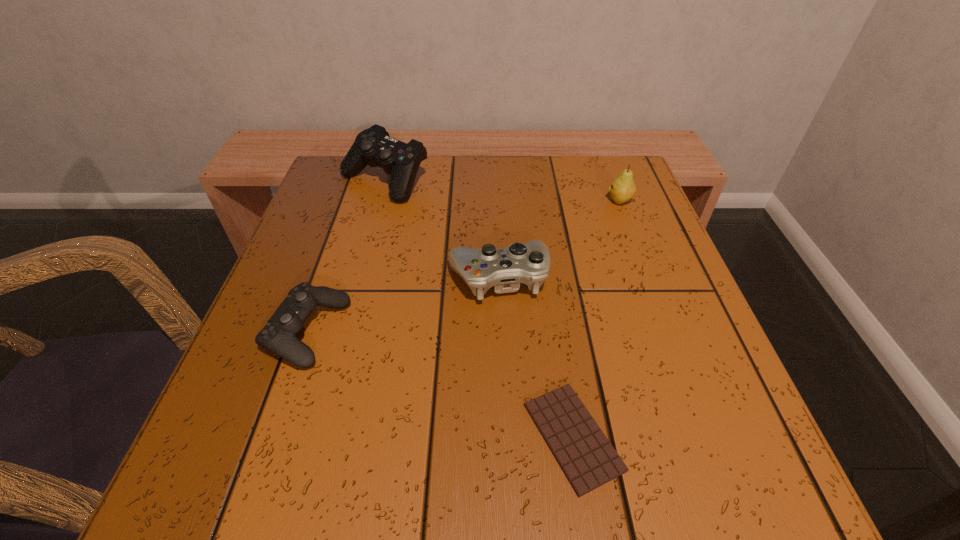
You are a GUI agent. You are given a task and a screenshot of the screen. Output one action in this format:
    pyautogui.click(x=<x>, y=<y>)
    Task: Click on the vacant space at the left edge of the desktop
    
    Given the screenshot: What is the action you would take?
    pyautogui.click(x=306, y=242)

Identify the location of vacant space at the right edge of the desktop. (x=632, y=247).

The height and width of the screenshot is (540, 960). What are the coordinates of `free space at the far left corner of the desktop` in the screenshot? It's located at (341, 180).

I want to click on free space at the far right corner, so [602, 198].

Where is `vacant space that's between the rightmost object and the farthest control`? Image resolution: width=960 pixels, height=540 pixels. vacant space that's between the rightmost object and the farthest control is located at coordinates (502, 191).

Where is `empty space that is in between the pear and the tallest control`? This screenshot has height=540, width=960. empty space that is in between the pear and the tallest control is located at coordinates (502, 191).

Where is `vacant point located between the rightmost object and the chocolate bar`? vacant point located between the rightmost object and the chocolate bar is located at coordinates (596, 319).

Where is `free spot between the third tallest object and the shortest object`? free spot between the third tallest object and the shortest object is located at coordinates (536, 357).

The width and height of the screenshot is (960, 540). Find the location of `vacant space in between the shortest control and the second tallest control`. vacant space in between the shortest control and the second tallest control is located at coordinates (402, 305).

The width and height of the screenshot is (960, 540). What are the coordinates of `vacant space in between the rightmost control and the farthest control` in the screenshot? It's located at (442, 229).